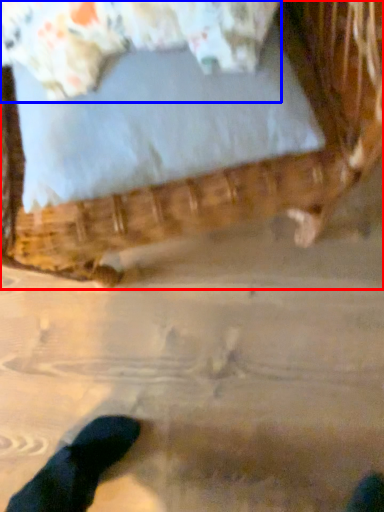
Question: Among these objects, which one is farthest to the camera, furniture (highlighted by a red box) or pillow (highlighted by a blue box)?

Choices:
 (A) furniture
 (B) pillow

Answer: (B)